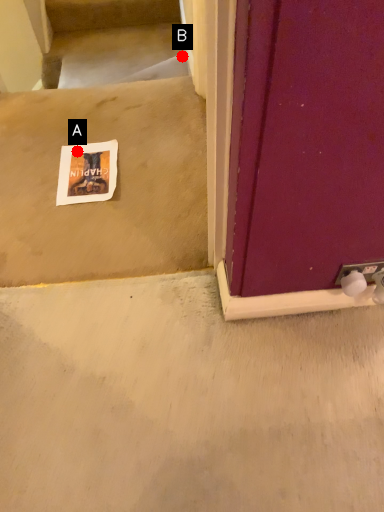
Question: Two points are circled on the image, labeled by A and B beside each circle. Which point is further to the camera?

Choices:
 (A) A is further
 (B) B is further

Answer: (B)